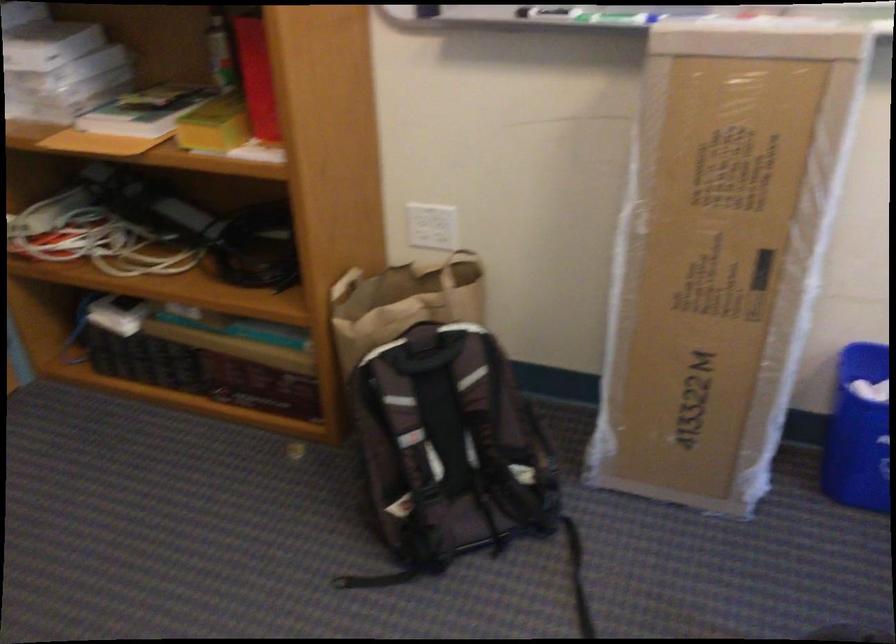
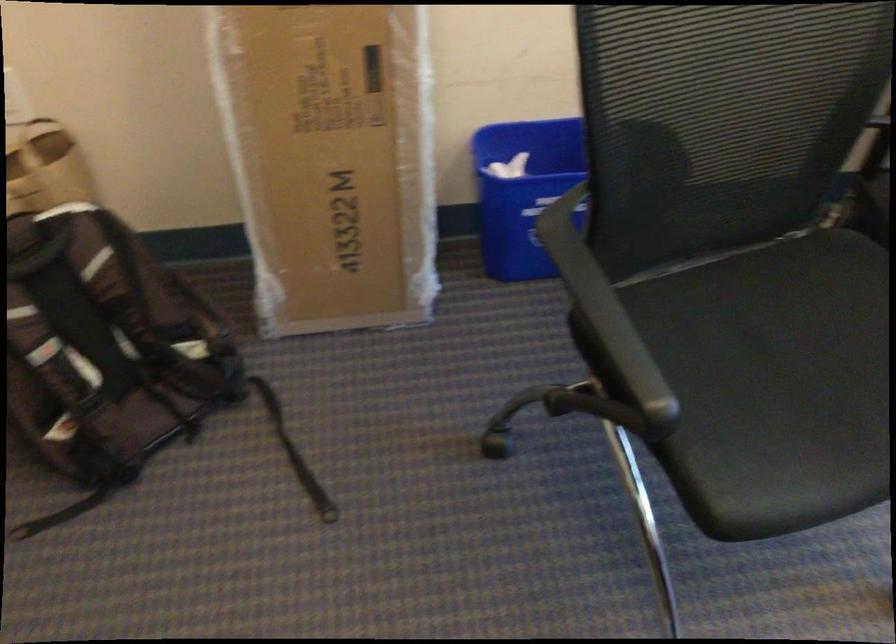
Question: Based on the continuous images, in which direction is the camera rotating? Reply with the corresponding letter.

Choices:
 (A) Left
 (B) Right
 (C) Up
 (D) Down

Answer: (B)